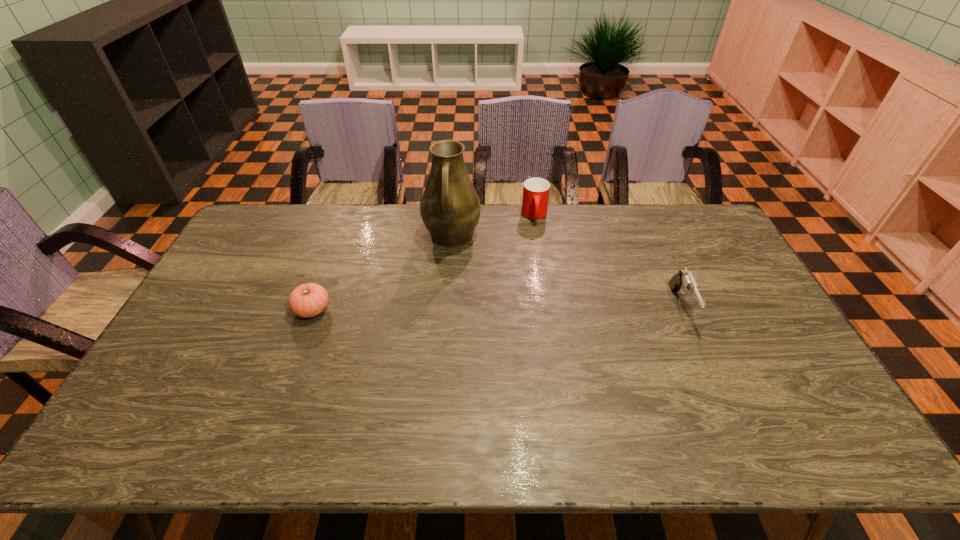
Where is `tomato`? tomato is located at coordinates (307, 300).

Where is `the leftmost object`? The height and width of the screenshot is (540, 960). the leftmost object is located at coordinates (307, 300).

At what (x,y) coordinates should I click in order to perform the action: click on gun. Please return your answer as a coordinate pair (x, y). The image size is (960, 540). Looking at the image, I should click on (684, 279).

Locate an element on the screen. The width and height of the screenshot is (960, 540). the tallest object is located at coordinates (450, 207).

The width and height of the screenshot is (960, 540). Find the location of `pitcher`. pitcher is located at coordinates [450, 207].

Locate an element on the screen. The height and width of the screenshot is (540, 960). cup is located at coordinates (536, 191).

Locate an element on the screen. vacant area situated on the right of the shortest object is located at coordinates (415, 309).

In order to click on free space located at the muzzle of the rightmost object in this screenshot , I will do `click(725, 406)`.

Locate an element on the screen. This screenshot has width=960, height=540. free space located on the handle side of the pitcher is located at coordinates (439, 346).

Where is `vacant area situated 0.360m on the handle side of the pitcher`? This screenshot has width=960, height=540. vacant area situated 0.360m on the handle side of the pitcher is located at coordinates (439, 346).